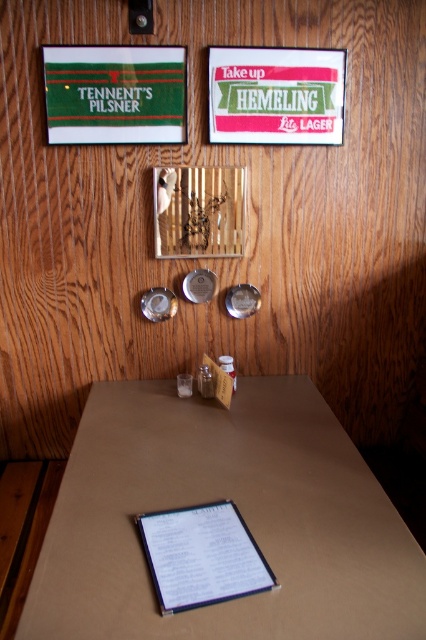
Please describe the location of the point labeled with coordinates (238, 509) in the image. Where is it located?

The point labeled with coordinates (238, 509) is located on the brown cardboard table at center.

What is the relationship in width between the brown cardboard table at center and the green fabric signboard at upper left?

The brown cardboard table at center is wider than the green fabric signboard at upper left.

Please provide the coordinates of the green fabric signboard at upper left in the image.

The green fabric signboard at upper left is located at coordinates point (115, 93).